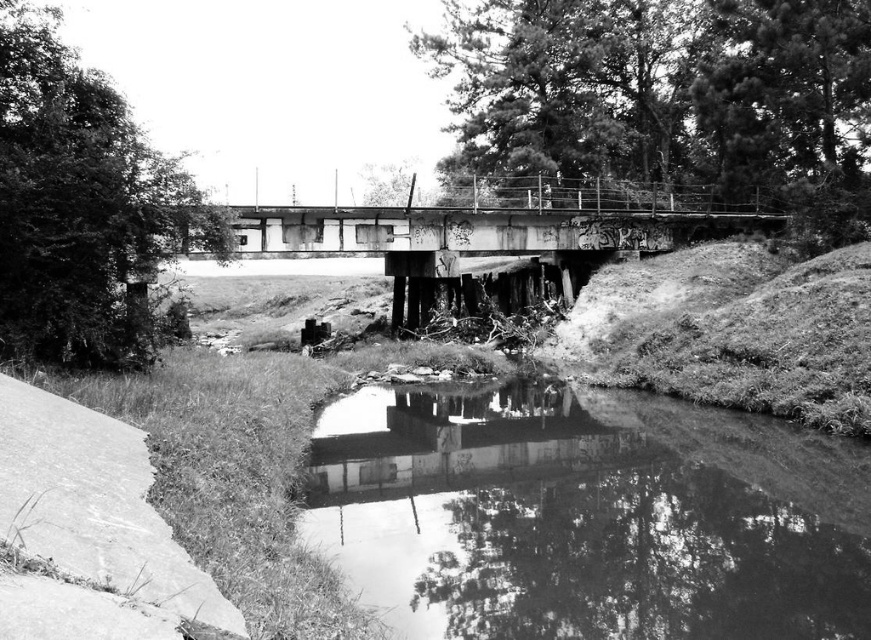
You are standing on the dilapidated bridge over the small waterway. You notice a point marked at coordinates (579, 520). Based on the scene description, what is the surface texture of the area at this point?

The point at (579, 520) indicates smooth concrete water at lower center, so the surface texture there is smooth.

You are a boat operator who wants to navigate a 30 feet long boat under the rusty metal bridge at center. The boat must stay on the smooth concrete water at lower center. Is the space between the water and the bridge sufficient for the boat to pass through?

The distance between the smooth concrete water at lower center and the rusty metal bridge at center is 32.63 feet, which is greater than the boat length of 30 feet. Therefore, the boat can safely pass under the bridge as there is enough clearance.

You are standing on the dilapidated bridge in the image. You see two points marked on the bridge deck. The first point is at coordinates point (751, 461) and the second point is at point (495, 224). If you want to move towards the point that is closer to the water below, which point should you walk towards?

Point (751, 461) is in front of point (495, 224), so it is closer to the water below. Therefore, you should walk towards point (751, 461).